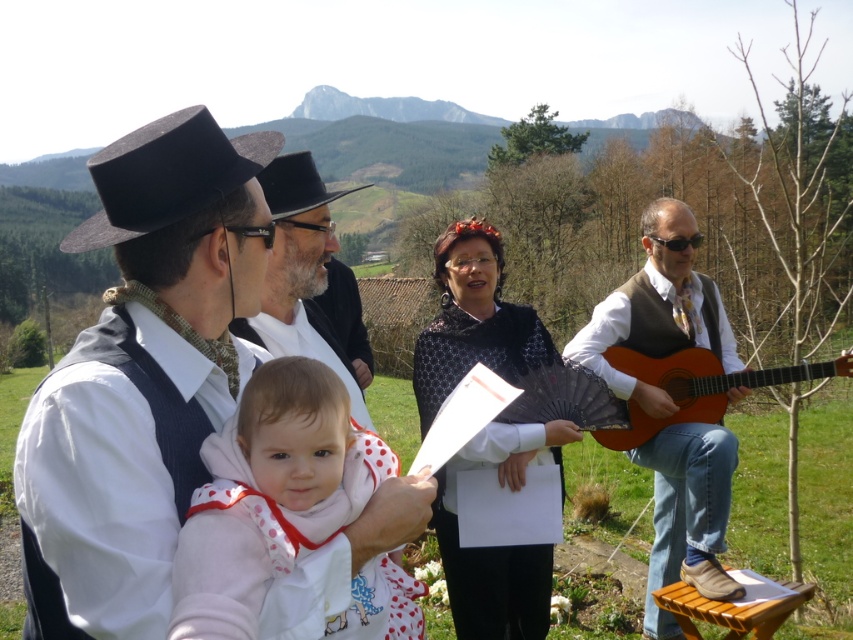
Who is more distant from viewer, (692,451) or (486,332)?

Point (692,451)

Is brown leather guitar at right shorter than black lace shawl at center?

No.

Which is in front, point (668, 305) or point (485, 611)?

Point (485, 611) is more forward.

The width and height of the screenshot is (853, 640). Find the location of `brown leather guitar at right`. brown leather guitar at right is located at coordinates (659, 308).

Does matte black hat at center have a smaller size compared to white polka dot fabric at center?

Incorrect, matte black hat at center is not smaller in size than white polka dot fabric at center.

Does point (102, 477) come in front of point (318, 419)?

Yes, it is in front of point (318, 419).

Does point (123, 467) lie in front of point (265, 442)?

Yes, point (123, 467) is closer to viewer.

Find the location of `matte black hat at center`. matte black hat at center is located at coordinates (186, 248).

Between point (248, 392) and point (659, 332), which one is positioned behind?

The point (659, 332) is behind.

Does white polka dot fabric at center have a greater width compared to brown leather guitar at right?

Incorrect, white polka dot fabric at center's width does not surpass brown leather guitar at right's.

Does point (399, 634) come behind point (651, 396)?

No, (399, 634) is in front of (651, 396).

Image resolution: width=853 pixels, height=640 pixels. I want to click on white polka dot fabric at center, so click(270, 496).